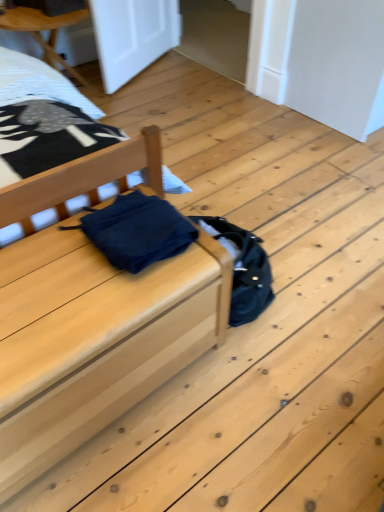
Identify the location of matte blue fabric at center. (47, 93).

Locate an element on the screen. The image size is (384, 512). matte wood bed at center is located at coordinates (93, 340).

Looking at this image, measure the distance between white textured sheet at upper left and camera.

The depth of white textured sheet at upper left is 5.93 feet.

The image size is (384, 512). What do you see at coordinates (137, 231) in the screenshot?
I see `dark blue fabric at center` at bounding box center [137, 231].

At what (x,y) coordinates should I click in order to perform the action: click on matte blue fabric at center. Please return your answer as a coordinate pair (x, y). This screenshot has height=512, width=384. Looking at the image, I should click on (47, 93).

Is matte blue fabric at center at the left side of white textured sheet at upper left?

No, matte blue fabric at center is not to the left of white textured sheet at upper left.

From the image's perspective, which is below, matte blue fabric at center or white textured sheet at upper left?

matte blue fabric at center, from the image's perspective.

Is white textured sheet at upper left surrounded by matte blue fabric at center?

Definitely not — white textured sheet at upper left is not inside matte blue fabric at center.

Is point (34, 67) positioned after point (51, 75)?

Yes, point (34, 67) is behind point (51, 75).

In the scene shown: Is there a large distance between dark blue fabric at center and white textured sheet at upper left?

That's not correct — dark blue fabric at center is a little close to white textured sheet at upper left.

Which object is positioned more to the right, dark blue fabric at center or white textured sheet at upper left?

dark blue fabric at center.

From a real-world perspective, does dark blue fabric at center stand above white textured sheet at upper left?

Yes, from a real-world perspective, dark blue fabric at center is on top of white textured sheet at upper left.

Is dark blue fabric at center taller or shorter than white textured sheet at upper left?

dark blue fabric at center is shorter than white textured sheet at upper left.

Is the surface of matte wood bed at center in direct contact with matte blue fabric at center?

matte wood bed at center and matte blue fabric at center are clearly separated.

Is matte wood bed at center wider than matte blue fabric at center?

No, matte wood bed at center is not wider than matte blue fabric at center.

From a real-world perspective, is matte wood bed at center positioned above or below matte blue fabric at center?

From a real-world perspective, matte wood bed at center is physically below matte blue fabric at center.

Between dark blue fabric at center and matte blue fabric at center, which one is positioned in front?

matte blue fabric at center is more forward.

Which of these two, dark blue fabric at center or matte blue fabric at center, is wider?

Wider between the two is matte blue fabric at center.

Is dark blue fabric at center not inside matte blue fabric at center?

Indeed, dark blue fabric at center is completely outside matte blue fabric at center.

Looking at this image, is dark blue fabric at center not close to matte blue fabric at center?

No, dark blue fabric at center is in close proximity to matte blue fabric at center.

Is white textured sheet at upper left far from matte blue fabric at center?

That's not correct — white textured sheet at upper left is a little close to matte blue fabric at center.

Is white textured sheet at upper left smaller than matte blue fabric at center?

Correct, white textured sheet at upper left occupies less space than matte blue fabric at center.

Can you tell me how much white textured sheet at upper left and matte blue fabric at center differ in facing direction?

They differ by 4.58 degrees in their facing directions.

Is white textured sheet at upper left closer to camera compared to matte blue fabric at center?

No, the depth of white textured sheet at upper left is greater than that of matte blue fabric at center.

Between white textured sheet at upper left and dark blue fabric at center, which one is positioned in front?

Positioned in front is dark blue fabric at center.

Based on the photo, from the image's perspective, which is above, white textured sheet at upper left or dark blue fabric at center?

white textured sheet at upper left, from the image's perspective.

Is white textured sheet at upper left facing away from dark blue fabric at center?

white textured sheet at upper left does not have its back to dark blue fabric at center.

Identify the location of furniture directly beneath the dark blue fabric at center (from a real-world perspective). The height and width of the screenshot is (512, 384). (93, 340).

Can you confirm if matte wood bed at center is bigger than dark blue fabric at center?

Indeed, matte wood bed at center has a larger size compared to dark blue fabric at center.

Which point is more distant from viewer, (x=28, y=316) or (x=121, y=214)?

The point (x=121, y=214) is farther.

Is matte wood bed at center wider or thinner than dark blue fabric at center?

matte wood bed at center is wider than dark blue fabric at center.

Locate an element on the screen. sheet located above the matte blue fabric at center (from the image's perspective) is located at coordinates (38, 83).

This screenshot has width=384, height=512. Find the location of `material in front of the white textured sheet at upper left`. material in front of the white textured sheet at upper left is located at coordinates (137, 231).

Estimate the real-world distances between objects in this image. Which object is further from dark blue fabric at center, white textured sheet at upper left or matte blue fabric at center?

Answer: white textured sheet at upper left is positioned further to the anchor dark blue fabric at center.

Estimate the real-world distances between objects in this image. Which object is further from matte wood bed at center, white textured sheet at upper left or matte blue fabric at center?

white textured sheet at upper left is further to matte wood bed at center.

Estimate the real-world distances between objects in this image. Which object is closer to matte wood bed at center, matte blue fabric at center or white textured sheet at upper left?

matte blue fabric at center.

Looking at the image, which one is located further to matte blue fabric at center, white textured sheet at upper left or dark blue fabric at center?

The object further to matte blue fabric at center is dark blue fabric at center.

Looking at the image, which one is located further to white textured sheet at upper left, matte wood bed at center or dark blue fabric at center?

The object further to white textured sheet at upper left is matte wood bed at center.

Looking at the image, which one is located further to matte blue fabric at center, dark blue fabric at center or white textured sheet at upper left?

Based on the image, dark blue fabric at center appears to be further to matte blue fabric at center.

Considering their positions, is white textured sheet at upper left positioned further to matte blue fabric at center than matte wood bed at center?

matte wood bed at center is further to matte blue fabric at center.

When comparing their distances from dark blue fabric at center, does matte wood bed at center or white textured sheet at upper left seem further?

white textured sheet at upper left is positioned further to the anchor dark blue fabric at center.

Where is `material that lies between white textured sheet at upper left and matte wood bed at center from top to bottom`? This screenshot has height=512, width=384. material that lies between white textured sheet at upper left and matte wood bed at center from top to bottom is located at coordinates (137, 231).

Where is `material between matte blue fabric at center and white textured sheet at upper left from front to back`? material between matte blue fabric at center and white textured sheet at upper left from front to back is located at coordinates [x=137, y=231].

Identify the location of bed positioned between matte wood bed at center and white textured sheet at upper left from near to far. (47, 93).

You are a GUI agent. You are given a task and a screenshot of the screen. Output one action in this format:
    pyautogui.click(x=<x>, y=<y>)
    Task: Click on the material between matte blue fabric at center and matte wood bed at center in the vertical direction
    
    Given the screenshot: What is the action you would take?
    pyautogui.click(x=137, y=231)